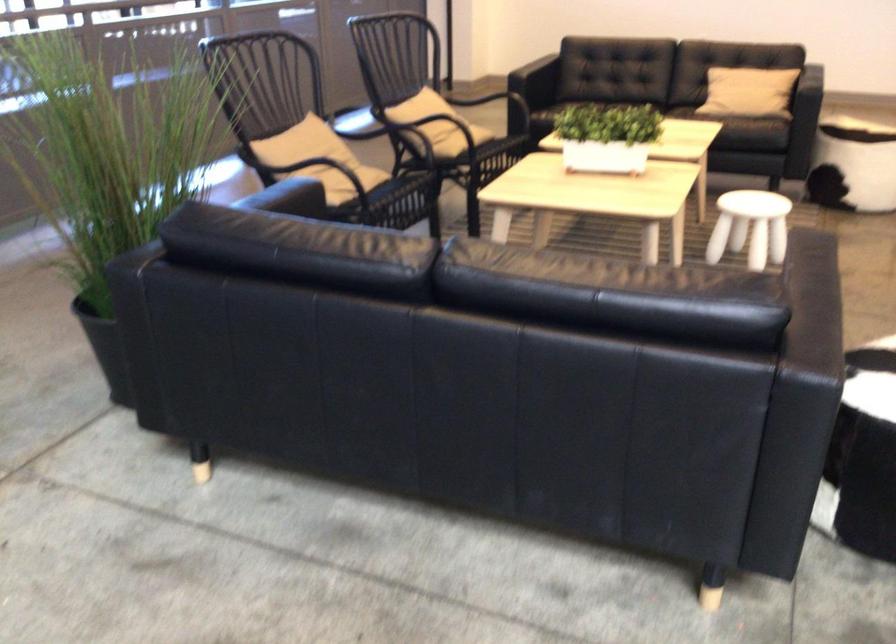
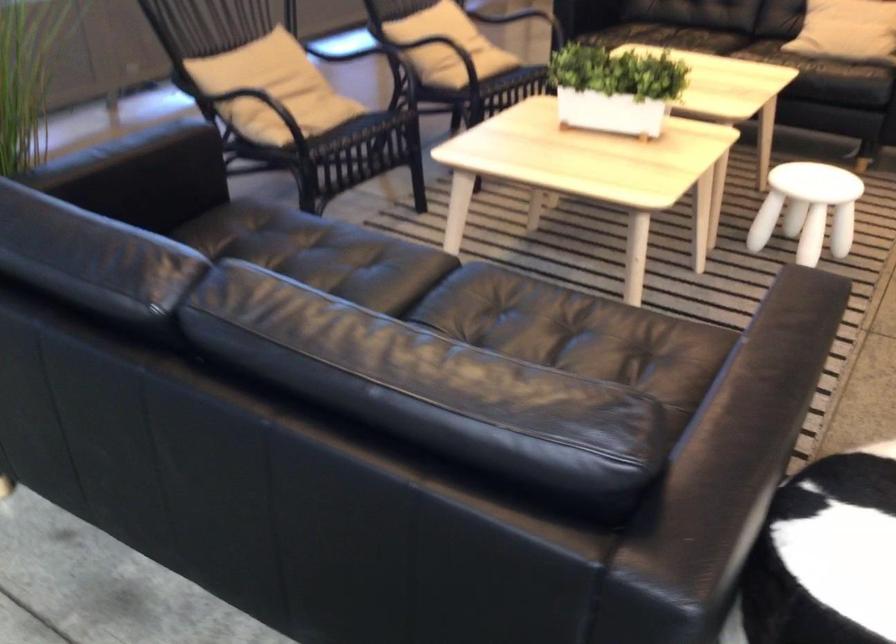
Find the pixel in the second image that matches point (613, 136) in the first image.

(615, 88)